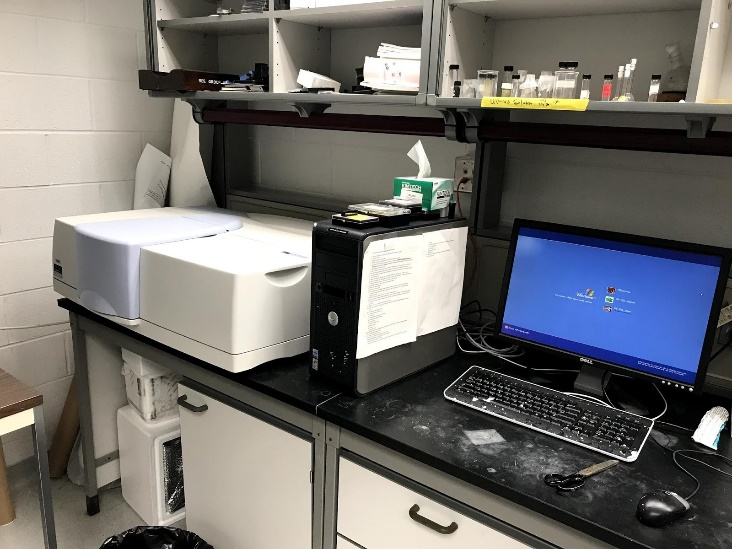
Image resolution: width=732 pixels, height=549 pixels. I want to click on handle, so click(432, 520), click(186, 407).